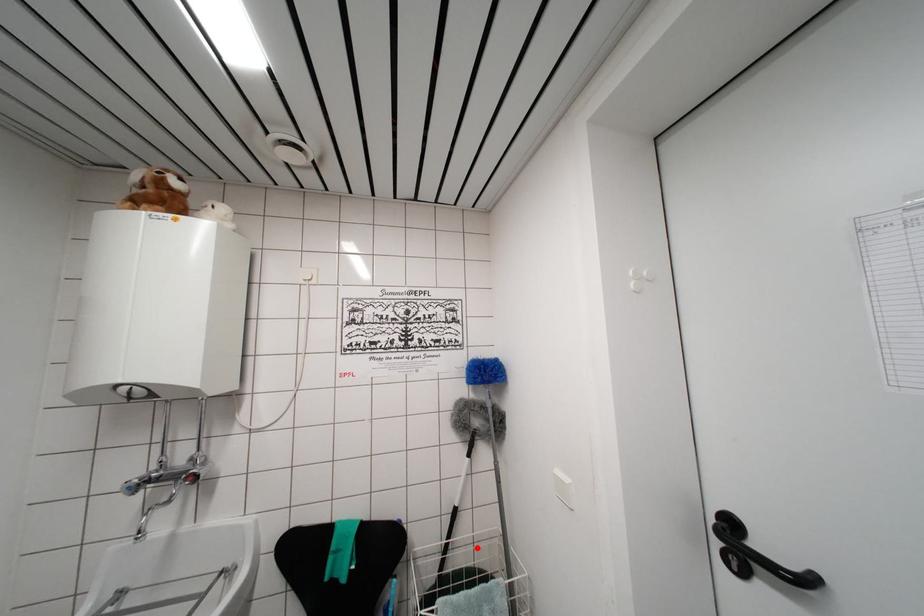
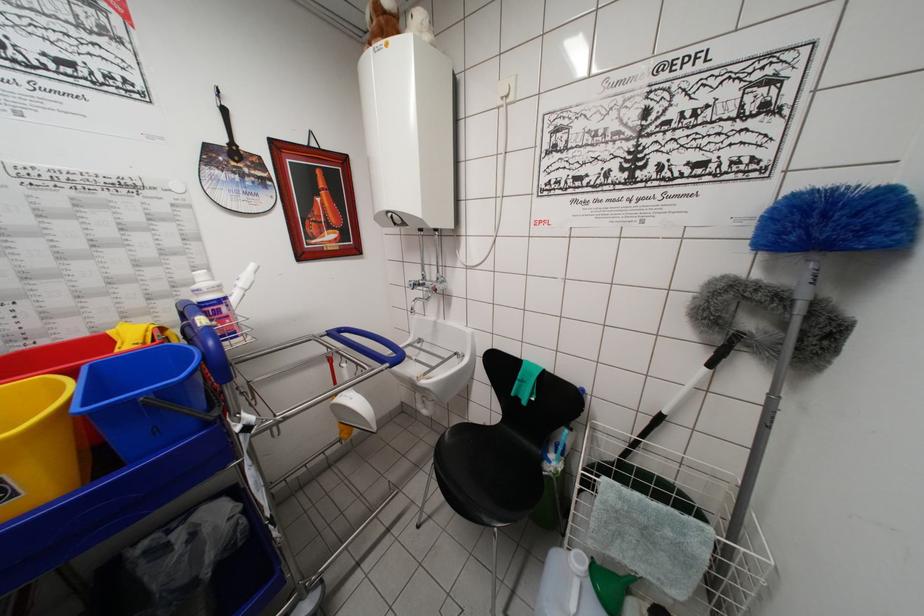
Locate, in the second image, the point that corresponds to the highlighted location in the first image.

(685, 469)